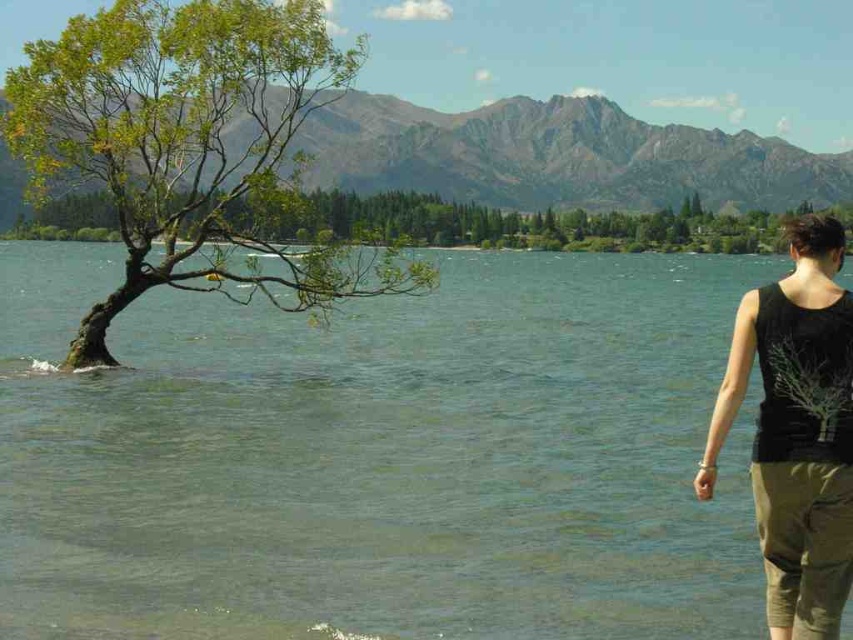
Does point (51, 52) lie in front of point (793, 243)?

No, it is not.

Is green leafy tree at left wider than black cotton tank top at right?

Correct, the width of green leafy tree at left exceeds that of black cotton tank top at right.

Is point (236, 29) farther from camera compared to point (816, 397)?

Yes, it is.

This screenshot has width=853, height=640. In order to click on green leafy tree at left in this screenshot , I will do `click(190, 145)`.

Who is positioned more to the left, clear water at center or green leafy tree at center?

From the viewer's perspective, green leafy tree at center appears more on the left side.

Is the position of clear water at center more distant than that of green leafy tree at center?

No.

Who is more forward, (631,516) or (729,230)?

Point (631,516) is in front.

You are a GUI agent. You are given a task and a screenshot of the screen. Output one action in this format:
    pyautogui.click(x=<x>, y=<y>)
    Task: Click on the clear water at center
    The image size is (853, 640).
    Given the screenshot: What is the action you would take?
    tap(379, 456)

Between clear water at center and green leafy tree at left, which one is positioned lower?

Positioned lower is clear water at center.

Between clear water at center and green leafy tree at left, which one is positioned higher?

green leafy tree at left

Which is behind, point (112, 394) or point (173, 179)?

The point (173, 179) is more distant.

Find the location of a particular element. clear water at center is located at coordinates (379, 456).